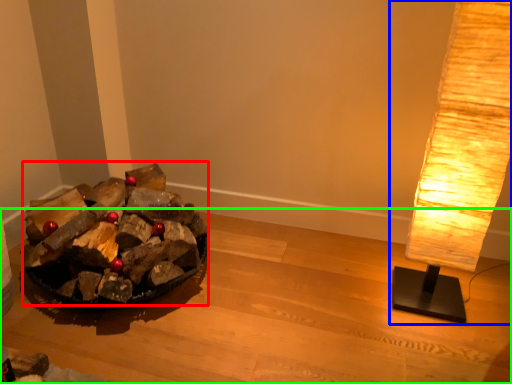
Question: Based on their relative distances, which object is farther from debris (highlighted by a red box)? Choose from lamp (highlighted by a blue box) and furniture (highlighted by a green box).

Choices:
 (A) lamp
 (B) furniture

Answer: (A)